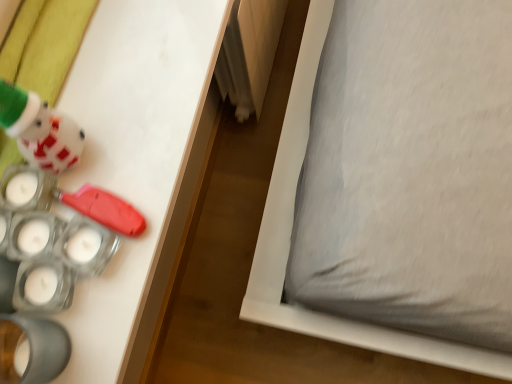
The height and width of the screenshot is (384, 512). Find the location of `gray fabric pillow at lower right`. gray fabric pillow at lower right is located at coordinates (410, 171).

Identify the location of translucent plastic candle holder at lower left, which is the second toy from top to bottom. The image size is (512, 384). (33, 349).

Between matte white plush at upper left, which is the first toy in top-to-bottom order, and gray fabric pillow at lower right, which one is positioned in front?

matte white plush at upper left, which is the first toy in top-to-bottom order, is more forward.

You are a GUI agent. You are given a task and a screenshot of the screen. Output one action in this format:
    pyautogui.click(x=<x>, y=<y>)
    Task: Click on the 2nd toy in front of the gray fabric pillow at lower right
    The width and height of the screenshot is (512, 384).
    Given the screenshot: What is the action you would take?
    pyautogui.click(x=39, y=130)

Is matte white plush at upper left, placed as the second toy when sorted from bottom to top, bigger than gray fabric pillow at lower right?

Actually, matte white plush at upper left, placed as the second toy when sorted from bottom to top, might be smaller than gray fabric pillow at lower right.

Is matte white plush at upper left, placed as the second toy when sorted from bottom to top, positioned with its back to gray fabric pillow at lower right?

No, matte white plush at upper left, placed as the second toy when sorted from bottom to top, is not facing the opposite direction of gray fabric pillow at lower right.

Is translucent plastic candle holder at lower left, which is counted as the first toy, starting from the bottom, aimed at matte white plush at upper left, which is the first toy in top-to-bottom order?

No, translucent plastic candle holder at lower left, which is counted as the first toy, starting from the bottom, is not facing towards matte white plush at upper left, which is the first toy in top-to-bottom order.

In the scene shown: Is translucent plastic candle holder at lower left, which is the second toy from top to bottom, in contact with matte white plush at upper left, which is the first toy in top-to-bottom order?

No.

Can you confirm if translucent plastic candle holder at lower left, which is counted as the first toy, starting from the bottom, is wider than matte white plush at upper left, which is the first toy in top-to-bottom order?

No, translucent plastic candle holder at lower left, which is counted as the first toy, starting from the bottom, is not wider than matte white plush at upper left, which is the first toy in top-to-bottom order.

What are the coordinates of `toy on the left of translucent plastic candle holder at lower left, which is counted as the first toy, starting from the bottom` in the screenshot? It's located at (39, 130).

Is gray fabric pillow at lower right taller than translucent plastic candle holder at lower left, which is the second toy from top to bottom?

Incorrect, the height of gray fabric pillow at lower right is not larger of that of translucent plastic candle holder at lower left, which is the second toy from top to bottom.

Which object is positioned more to the left, gray fabric pillow at lower right or translucent plastic candle holder at lower left, which is the second toy from top to bottom?

translucent plastic candle holder at lower left, which is the second toy from top to bottom.

From the picture: Are gray fabric pillow at lower right and translucent plastic candle holder at lower left, which is the second toy from top to bottom, far apart?

No, gray fabric pillow at lower right is in close proximity to translucent plastic candle holder at lower left, which is the second toy from top to bottom.

Who is bigger, gray fabric pillow at lower right or translucent plastic candle holder at lower left, which is counted as the first toy, starting from the bottom?

gray fabric pillow at lower right is bigger.

How many degrees apart are the facing directions of gray fabric pillow at lower right and matte white plush at upper left, placed as the second toy when sorted from bottom to top?

The angular difference between gray fabric pillow at lower right and matte white plush at upper left, placed as the second toy when sorted from bottom to top, is 1.18 degrees.

Is gray fabric pillow at lower right directly adjacent to matte white plush at upper left, which is the first toy in top-to-bottom order?

No, gray fabric pillow at lower right is not in contact with matte white plush at upper left, which is the first toy in top-to-bottom order.

At what (x,y) coordinates should I click in order to perform the action: click on pillow on the right of matte white plush at upper left, which is the first toy in top-to-bottom order. Please return your answer as a coordinate pair (x, y). Looking at the image, I should click on (410, 171).

Between matte white plush at upper left, placed as the second toy when sorted from bottom to top, and translucent plastic candle holder at lower left, which is the second toy from top to bottom, which one has larger width?

matte white plush at upper left, placed as the second toy when sorted from bottom to top.

Is translucent plastic candle holder at lower left, which is counted as the first toy, starting from the bottom, at the back of matte white plush at upper left, which is the first toy in top-to-bottom order?

No, matte white plush at upper left, which is the first toy in top-to-bottom order,'s orientation is not away from translucent plastic candle holder at lower left, which is counted as the first toy, starting from the bottom.

Which object is positioned more to the right, matte white plush at upper left, placed as the second toy when sorted from bottom to top, or translucent plastic candle holder at lower left, which is counted as the first toy, starting from the bottom?

Positioned to the right is translucent plastic candle holder at lower left, which is counted as the first toy, starting from the bottom.

Measure the distance from matte white plush at upper left, placed as the second toy when sorted from bottom to top, to translucent plastic candle holder at lower left, which is the second toy from top to bottom.

matte white plush at upper left, placed as the second toy when sorted from bottom to top, is 7.70 inches away from translucent plastic candle holder at lower left, which is the second toy from top to bottom.

Which object is more forward, translucent plastic candle holder at lower left, which is counted as the first toy, starting from the bottom, or gray fabric pillow at lower right?

translucent plastic candle holder at lower left, which is counted as the first toy, starting from the bottom, is more forward.

From a real-world perspective, is translucent plastic candle holder at lower left, which is counted as the first toy, starting from the bottom, located higher than gray fabric pillow at lower right?

Yes, from a real-world perspective, translucent plastic candle holder at lower left, which is counted as the first toy, starting from the bottom, is on top of gray fabric pillow at lower right.

From the image's perspective, is translucent plastic candle holder at lower left, which is the second toy from top to bottom, above or below gray fabric pillow at lower right?

Based on their image positions, translucent plastic candle holder at lower left, which is the second toy from top to bottom, is located beneath gray fabric pillow at lower right.

Find the location of `pillow that is above the translucent plastic candle holder at lower left, which is counted as the first toy, starting from the bottom (from the image's perspective)`. pillow that is above the translucent plastic candle holder at lower left, which is counted as the first toy, starting from the bottom (from the image's perspective) is located at coordinates (410, 171).

What are the coordinates of `pillow behind the matte white plush at upper left, placed as the second toy when sorted from bottom to top` in the screenshot? It's located at (410, 171).

At what (x,y) coordinates should I click in order to perform the action: click on toy on the left of translucent plastic candle holder at lower left, which is counted as the first toy, starting from the bottom. Please return your answer as a coordinate pair (x, y). The width and height of the screenshot is (512, 384). Looking at the image, I should click on (39, 130).

Based on the photo, estimate the real-world distances between objects in this image. Which object is further from gray fabric pillow at lower right, matte white plush at upper left, which is the first toy in top-to-bottom order, or translucent plastic candle holder at lower left, which is the second toy from top to bottom?

translucent plastic candle holder at lower left, which is the second toy from top to bottom.

Which object lies nearer to the anchor point matte white plush at upper left, placed as the second toy when sorted from bottom to top, gray fabric pillow at lower right or translucent plastic candle holder at lower left, which is the second toy from top to bottom?

Among the two, translucent plastic candle holder at lower left, which is the second toy from top to bottom, is located nearer to matte white plush at upper left, placed as the second toy when sorted from bottom to top.

Looking at this image, estimate the real-world distances between objects in this image. Which object is closer to matte white plush at upper left, which is the first toy in top-to-bottom order, translucent plastic candle holder at lower left, which is counted as the first toy, starting from the bottom, or gray fabric pillow at lower right?

The object closer to matte white plush at upper left, which is the first toy in top-to-bottom order, is translucent plastic candle holder at lower left, which is counted as the first toy, starting from the bottom.

From the image, which object appears to be farther from translucent plastic candle holder at lower left, which is counted as the first toy, starting from the bottom, matte white plush at upper left, placed as the second toy when sorted from bottom to top, or gray fabric pillow at lower right?

Based on the image, gray fabric pillow at lower right appears to be further to translucent plastic candle holder at lower left, which is counted as the first toy, starting from the bottom.

Estimate the real-world distances between objects in this image. Which object is further from gray fabric pillow at lower right, translucent plastic candle holder at lower left, which is counted as the first toy, starting from the bottom, or matte white plush at upper left, placed as the second toy when sorted from bottom to top?

The object further to gray fabric pillow at lower right is translucent plastic candle holder at lower left, which is counted as the first toy, starting from the bottom.

Based on their spatial positions, is gray fabric pillow at lower right or matte white plush at upper left, placed as the second toy when sorted from bottom to top, closer to translucent plastic candle holder at lower left, which is counted as the first toy, starting from the bottom?

matte white plush at upper left, placed as the second toy when sorted from bottom to top, is closer to translucent plastic candle holder at lower left, which is counted as the first toy, starting from the bottom.

Locate an element on the screen. toy positioned between matte white plush at upper left, placed as the second toy when sorted from bottom to top, and gray fabric pillow at lower right from near to far is located at coordinates (33, 349).